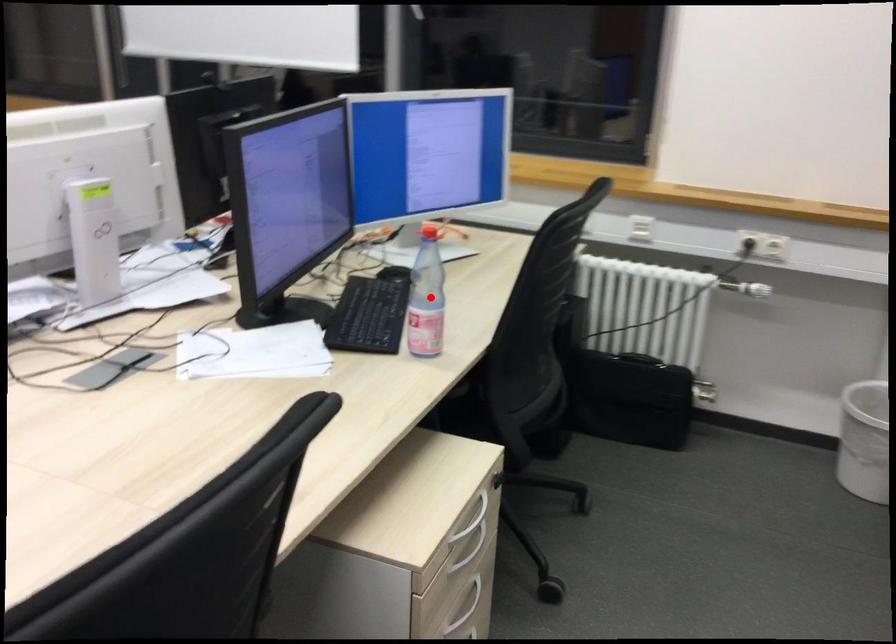
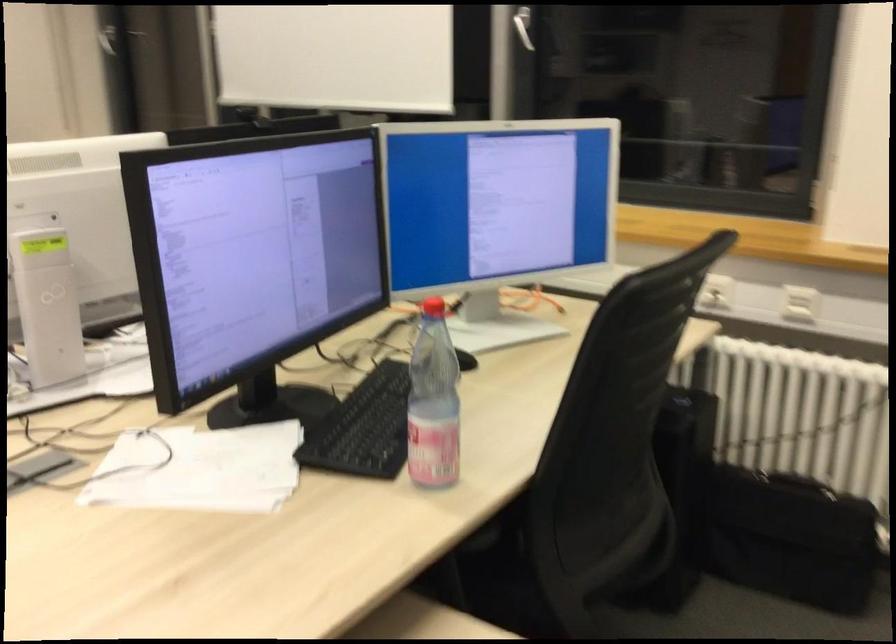
Question: I am providing you with two images of the same scene from different viewpoints. Given a red point in image1, look at the same physical point in image2. Is it:

Choices:
 (A) Closer to the viewpoint
 (B) Farther from the viewpoint

Answer: (A)